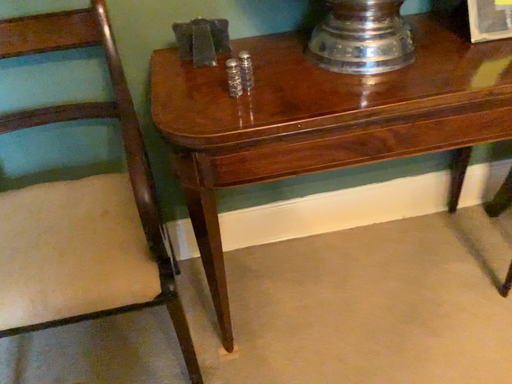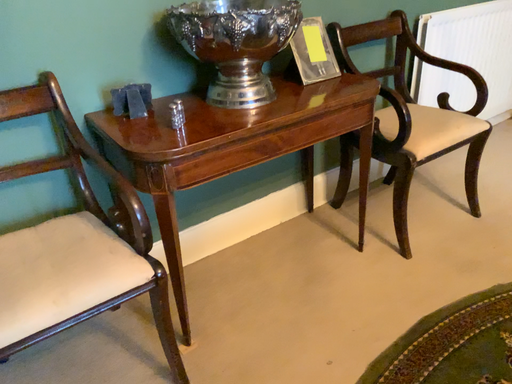
Question: Which way did the camera rotate in the video?

Choices:
 (A) rotated upward
 (B) rotated downward

Answer: (A)